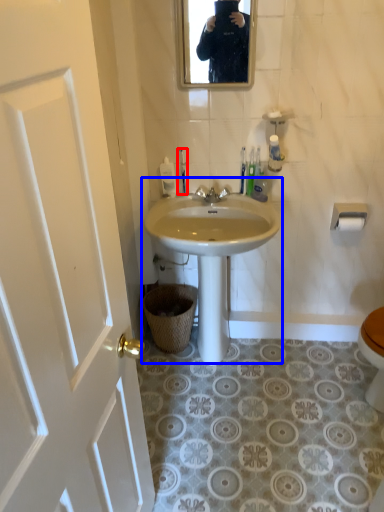
Question: Which of the following is the closest to the observer, toilet brush (highlighted by a red box) or sink (highlighted by a blue box)?

Choices:
 (A) toilet brush
 (B) sink

Answer: (B)